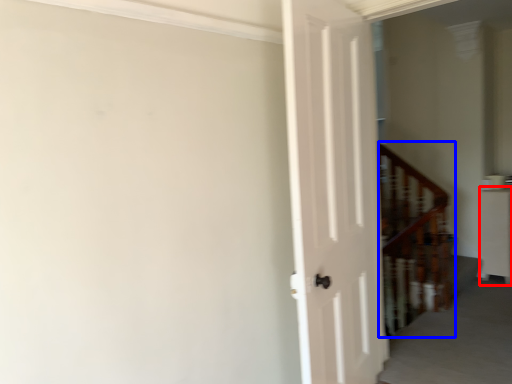
Question: Among these objects, which one is nearest to the camera, furniture (highlighted by a red box) or stairwell (highlighted by a blue box)?

Choices:
 (A) furniture
 (B) stairwell

Answer: (B)